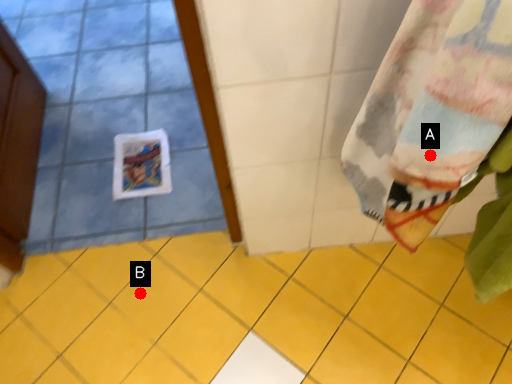
Question: Two points are circled on the image, labeled by A and B beside each circle. Which point is closer to the camera taking this photo?

Choices:
 (A) A is closer
 (B) B is closer

Answer: (A)